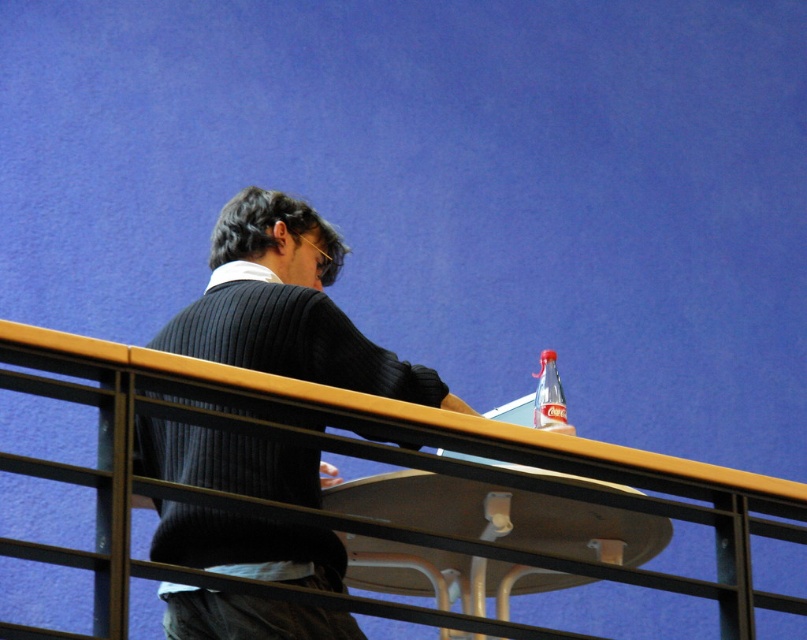
Question: Is yellow wood rail at upper center to the right of ribbed sweater at center from the viewer's perspective?

Choices:
 (A) yes
 (B) no

Answer: (A)

Question: Is yellow wood rail at upper center closer to the viewer compared to translucent plastic bottle at upper right?

Choices:
 (A) yes
 (B) no

Answer: (A)

Question: Which object is farther from the camera taking this photo?

Choices:
 (A) yellow wood rail at upper center
 (B) translucent plastic bottle at upper right
 (C) ribbed sweater at center

Answer: (B)

Question: Which object is closer to the camera taking this photo?

Choices:
 (A) yellow wood rail at upper center
 (B) ribbed sweater at center
 (C) translucent plastic bottle at upper right

Answer: (A)

Question: Is ribbed sweater at center below translucent plastic bottle at upper right?

Choices:
 (A) yes
 (B) no

Answer: (B)

Question: Among these objects, which one is farthest from the camera?

Choices:
 (A) yellow wood rail at upper center
 (B) translucent plastic bottle at upper right
 (C) ribbed sweater at center

Answer: (B)